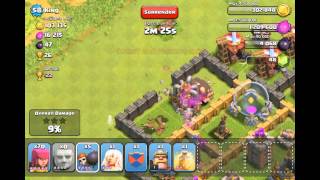
I want to click on wall, so click(201, 67).